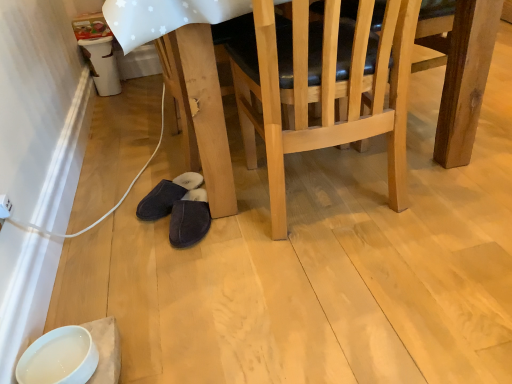
Find the location of `free space in front of dark suede slippers at lower center, arranged as the second footwear when viewed from the left`. free space in front of dark suede slippers at lower center, arranged as the second footwear when viewed from the left is located at coordinates (193, 267).